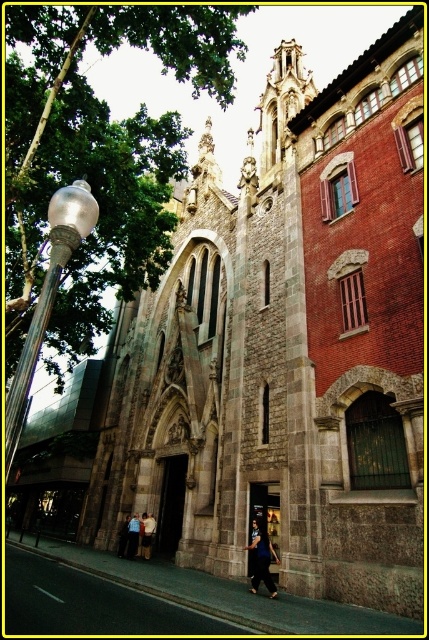
You are a GUI agent. You are given a task and a screenshot of the screen. Output one action in this format:
    pyautogui.click(x=<x>, y=<y>)
    Task: Click on the satin silver pole at left
    This screenshot has width=429, height=640.
    Given the screenshot: What is the action you would take?
    pyautogui.click(x=48, y=298)

Does point (87, 232) lie behind point (250, 545)?

No, (87, 232) is closer to viewer.

The height and width of the screenshot is (640, 429). Identify the location of satin silver pole at left. (48, 298).

Can you confirm if light blue shirt at center is wider than light blue denim pants at lower center?

Incorrect, light blue shirt at center's width does not surpass light blue denim pants at lower center's.

Is point (142, 540) positioned after point (133, 540)?

Yes, point (142, 540) is behind point (133, 540).

Locate an element on the screen. light blue shirt at center is located at coordinates (148, 534).

Does satin silver pole at left have a greater width compared to light blue shirt at center?

Indeed, satin silver pole at left has a greater width compared to light blue shirt at center.

Is satin silver pole at left closer to the viewer compared to light blue shirt at center?

Yes, it is.

Between point (84, 234) and point (141, 541), which one is positioned in front?

Point (84, 234) is more forward.

Find the location of `satin silver pole at left`. satin silver pole at left is located at coordinates (48, 298).